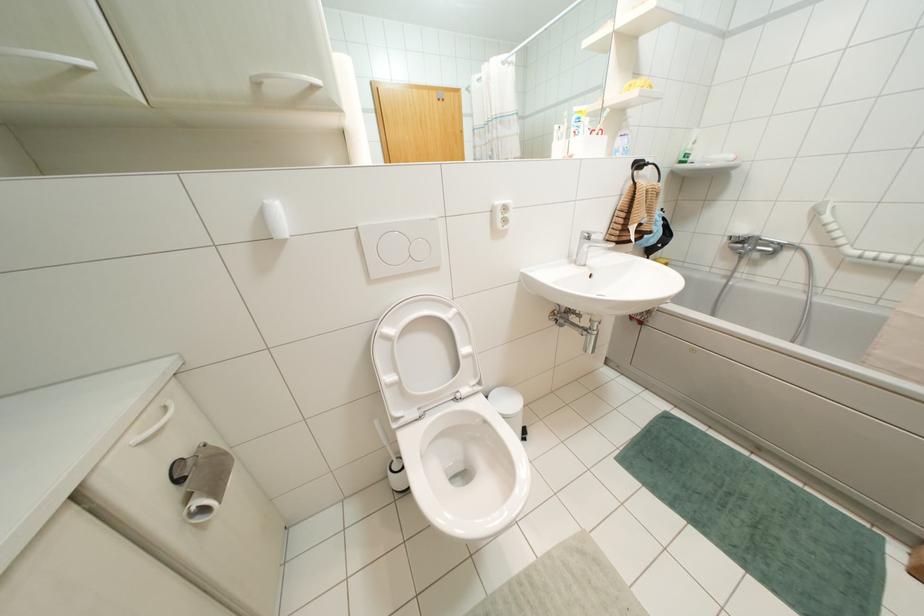
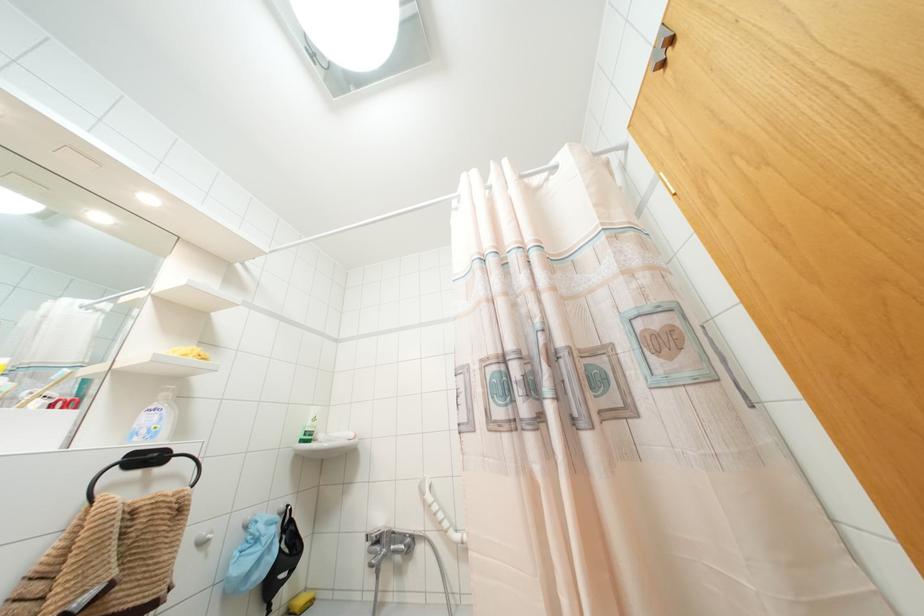
The point at (x=694, y=142) is marked in the first image. Where is the corresponding point in the second image?

(312, 419)